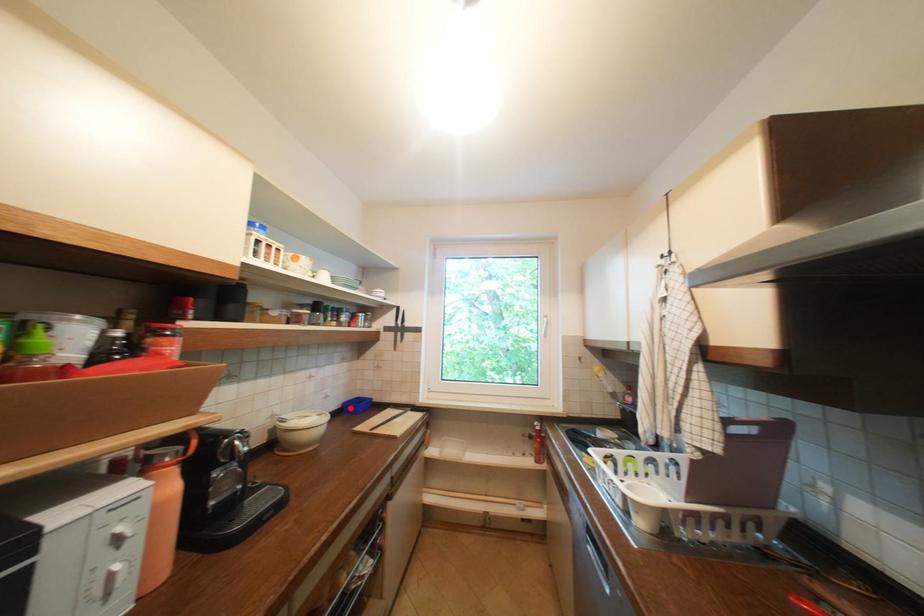
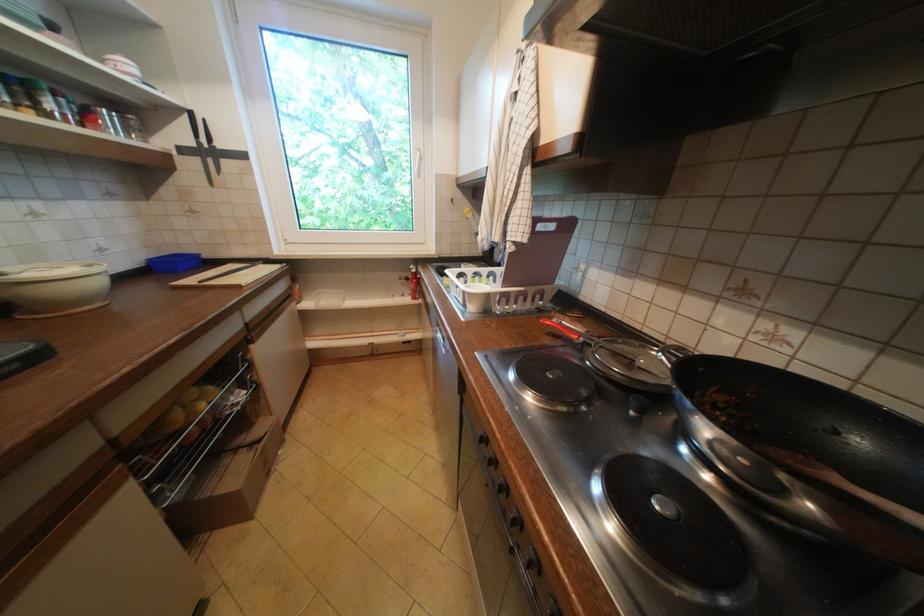
In the second image, find the point that corresponds to the highlighted location in the first image.

(156, 267)